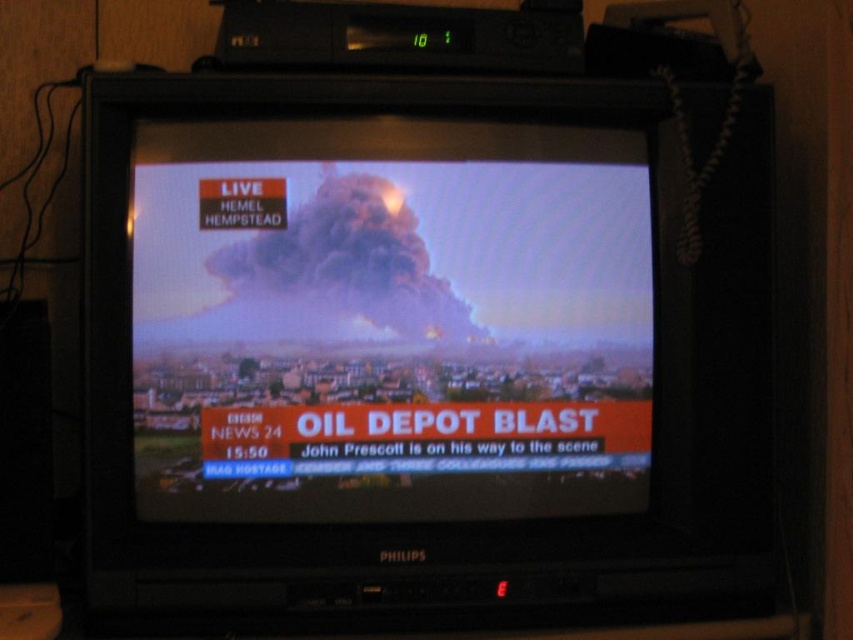
Is smoke cloud at center further to the viewer compared to smokedark gray/blackcloud at center?

No, smoke cloud at center is closer to the viewer.

From the picture: Measure the distance between smoke cloud at center and smokedark gray/blackcloud at center.

smoke cloud at center is 2.46 inches from smokedark gray/blackcloud at center.

Find the location of a particular element. This screenshot has width=853, height=640. smoke cloud at center is located at coordinates (389, 321).